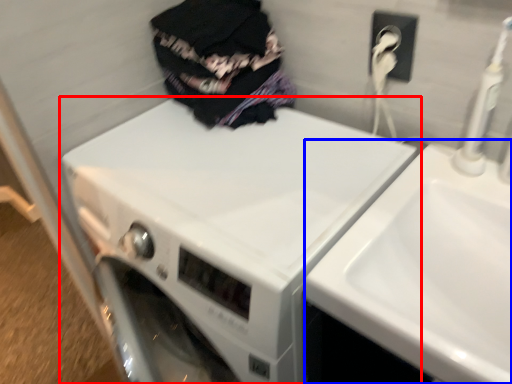
Question: Which point is closer to the camera, washing machine (highlighted by a red box) or sink (highlighted by a blue box)?

Choices:
 (A) washing machine
 (B) sink

Answer: (B)